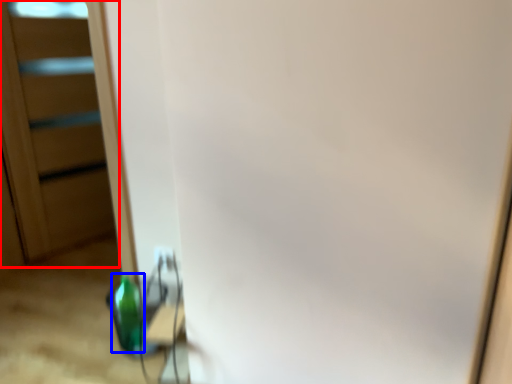
Question: Which of the following is the closest to the observer, screen door (highlighted by a red box) or bottle (highlighted by a blue box)?

Choices:
 (A) screen door
 (B) bottle

Answer: (B)